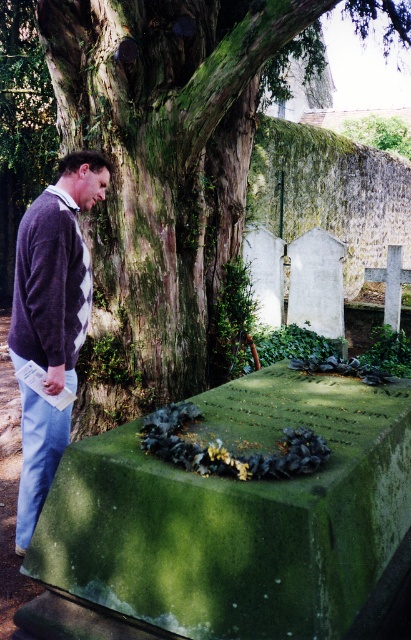
You are standing at point (x=161, y=172) in the cemetery scene. What object is located exactly at this coordinate?

The green mossy tree trunk at upper left is located exactly at point (x=161, y=172).

You are a visitor at this historical site and want to take a photo of the large mossy stone structure. However, there is a person wearing a dark purple sweater at left blocking your view. Can you move around to the right side of the stone to get an unobstructed shot?

Yes, you can move to the right side of the stone because the dark purple sweater at left is positioned to the left, so moving right would allow you to avoid the obstruction.